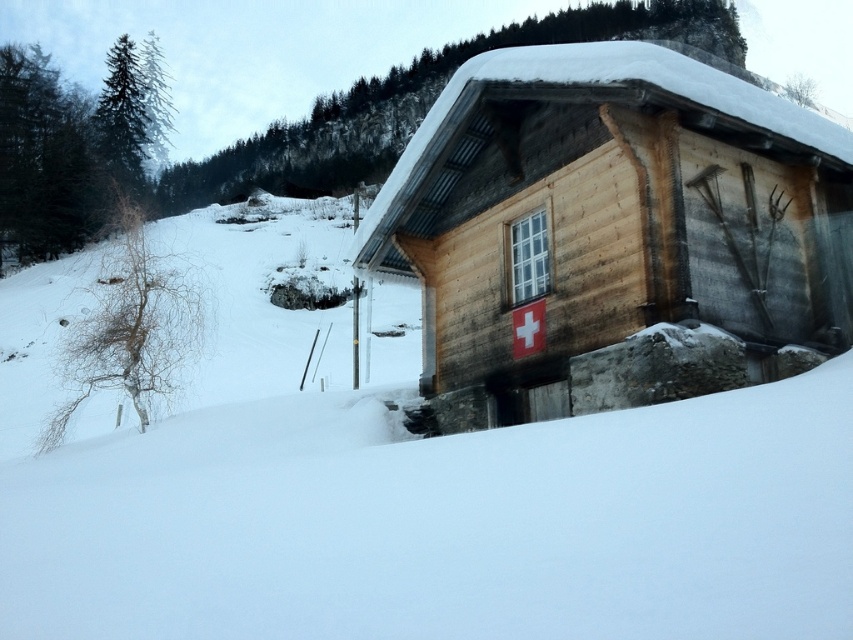
Question: Is wooden log cabin at center above wooden cabin at center?

Choices:
 (A) no
 (B) yes

Answer: (A)

Question: Which object is farther from the camera taking this photo?

Choices:
 (A) wooden log cabin at center
 (B) wooden cabin at center

Answer: (B)

Question: Is wooden log cabin at center closer to camera compared to wooden cabin at center?

Choices:
 (A) yes
 (B) no

Answer: (A)

Question: Is wooden log cabin at center closer to the viewer compared to wooden cabin at center?

Choices:
 (A) no
 (B) yes

Answer: (B)

Question: Which object is closer to the camera taking this photo?

Choices:
 (A) wooden cabin at center
 (B) wooden log cabin at center

Answer: (B)